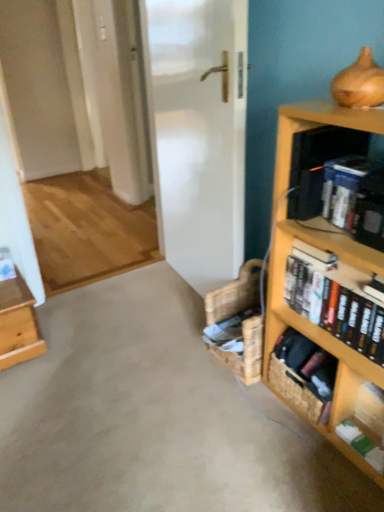
Measure the distance between point (336, 323) and camera.

Point (336, 323) and camera are 1.37 meters apart.

Measure the distance between light brown wooden table at left and camera.

The depth of light brown wooden table at left is 1.83 meters.

What do you see at coordinates (318, 163) in the screenshot?
I see `black plastic shelf at upper right` at bounding box center [318, 163].

The height and width of the screenshot is (512, 384). What do you see at coordinates (303, 374) in the screenshot?
I see `woven brown basket at lower right` at bounding box center [303, 374].

Measure the distance between wooden bookcase at right and camera.

wooden bookcase at right is 1.04 meters away from camera.

You are a GUI agent. You are given a task and a screenshot of the screen. Output one action in this format:
    pyautogui.click(x=<x>, y=<y>)
    Task: Click on the hardcover books at right, the second book when ordered from top to bottom
    The width and height of the screenshot is (384, 512).
    Given the screenshot: What is the action you would take?
    pyautogui.click(x=335, y=298)

Between point (71, 393) and point (348, 217), which one is positioned behind?

The point (71, 393) is behind.

Considering the relative sizes of smooth concrete floor at center and blue hardcover book at upper right, which ranks as the first book in top-to-bottom order, in the image provided, is smooth concrete floor at center thinner than blue hardcover book at upper right, which ranks as the first book in top-to-bottom order,?

In fact, smooth concrete floor at center might be wider than blue hardcover book at upper right, which ranks as the first book in top-to-bottom order.

Considering the positions of objects smooth concrete floor at center and blue hardcover book at upper right, which ranks as the first book in top-to-bottom order, in the image provided, who is behind, smooth concrete floor at center or blue hardcover book at upper right, which ranks as the first book in top-to-bottom order,?

blue hardcover book at upper right, which ranks as the first book in top-to-bottom order, is behind.

In the scene shown: Which is more to the right, smooth concrete floor at center or blue hardcover book at upper right, which ranks as the 3th book in bottom-to-top order?

blue hardcover book at upper right, which ranks as the 3th book in bottom-to-top order.

Looking at this image, could you tell me if light brown wooden table at left is turned towards green matte book at lower right, placed as the third book when sorted from top to bottom?

No.

Does light brown wooden table at left appear on the left side of green matte book at lower right, placed as the third book when sorted from top to bottom?

Yes, light brown wooden table at left is to the left of green matte book at lower right, placed as the third book when sorted from top to bottom.

Consider the image. Is light brown wooden table at left in front of or behind green matte book at lower right, placed as the third book when sorted from top to bottom, in the image?

In the image, light brown wooden table at left appears behind green matte book at lower right, placed as the third book when sorted from top to bottom.

Is blue hardcover book at upper right, which ranks as the 3th book in bottom-to-top order, completely or partially outside of light brown wooden table at left?

blue hardcover book at upper right, which ranks as the 3th book in bottom-to-top order, lies outside light brown wooden table at left's area.

Is blue hardcover book at upper right, which ranks as the 3th book in bottom-to-top order, shorter than light brown wooden table at left?

Indeed, blue hardcover book at upper right, which ranks as the 3th book in bottom-to-top order, has a lesser height compared to light brown wooden table at left.

Is blue hardcover book at upper right, which ranks as the first book in top-to-bottom order, facing away from light brown wooden table at left?

No.

Considering the positions of objects blue hardcover book at upper right, which ranks as the first book in top-to-bottom order, and light brown wooden table at left in the image provided, who is more to the right, blue hardcover book at upper right, which ranks as the first book in top-to-bottom order, or light brown wooden table at left?

From the viewer's perspective, blue hardcover book at upper right, which ranks as the first book in top-to-bottom order, appears more on the right side.

Considering the relative sizes of black plastic shelf at upper right and wooden bookcase at right in the image provided, is black plastic shelf at upper right wider than wooden bookcase at right?

No, black plastic shelf at upper right is not wider than wooden bookcase at right.

Who is more distant, black plastic shelf at upper right or wooden bookcase at right?

Positioned behind is black plastic shelf at upper right.

The image size is (384, 512). In order to click on shelf located above the wooden bookcase at right (from a real-world perspective) in this screenshot , I will do `click(318, 163)`.

Considering the relative positions of black plastic shelf at upper right and wooden bookcase at right in the image provided, is black plastic shelf at upper right to the right of wooden bookcase at right from the viewer's perspective?

No, black plastic shelf at upper right is not to the right of wooden bookcase at right.

Which is correct: woven brown basket at lower right is inside black plastic shelf at upper right, or outside of it?

woven brown basket at lower right is not enclosed by black plastic shelf at upper right.

Is woven brown basket at lower right next to black plastic shelf at upper right and touching it?

There is a gap between woven brown basket at lower right and black plastic shelf at upper right.

Is woven brown basket at lower right facing away from black plastic shelf at upper right?

No, woven brown basket at lower right is not facing away from black plastic shelf at upper right.

Is point (362, 215) closer or farther from the camera than point (73, 339)?

Point (362, 215) appears to be closer to the viewer than point (73, 339).

Could you measure the distance between blue hardcover book at upper right, which ranks as the 3th book in bottom-to-top order, and smooth concrete floor at center?

38.32 inches.

Relative to smooth concrete floor at center, is blue hardcover book at upper right, which ranks as the first book in top-to-bottom order, in front or behind?

blue hardcover book at upper right, which ranks as the first book in top-to-bottom order, is positioned farther from the viewer than smooth concrete floor at center.

From the image's perspective, which is above, blue hardcover book at upper right, which ranks as the 3th book in bottom-to-top order, or smooth concrete floor at center?

blue hardcover book at upper right, which ranks as the 3th book in bottom-to-top order.

From a real-world perspective, who is located higher, wooden bookcase at right or woven brown basket at lower right?

From a 3D spatial view, wooden bookcase at right is above.

Between wooden bookcase at right and woven brown basket at lower right, which one has larger width?

With larger width is wooden bookcase at right.

Can you confirm if wooden bookcase at right is positioned to the right of woven brown basket at lower right?

Indeed, wooden bookcase at right is positioned on the right side of woven brown basket at lower right.

Is wooden bookcase at right positioned far away from woven brown basket at lower right?

They are positioned close to each other.

I want to click on concrete on the left of the blue hardcover book at upper right, which ranks as the first book in top-to-bottom order, so click(155, 416).

Locate an element on the screen. This screenshot has width=384, height=512. table behind the green matte book at lower right, placed as the third book when sorted from top to bottom is located at coordinates (18, 323).

Which object lies nearer to the anchor point light brown wooden table at left, hardcover books at right, the second book when ordered from top to bottom, or blue hardcover book at upper right, which ranks as the 3th book in bottom-to-top order?

hardcover books at right, the second book when ordered from top to bottom.

Estimate the real-world distances between objects in this image. Which object is further from woven brown basket at lower right, black plastic shelf at upper right or light brown wooden table at left?

Based on the image, light brown wooden table at left appears to be further to woven brown basket at lower right.

Considering their positions, is woven brown basket at lower right positioned closer to light brown wooden table at left than blue hardcover book at upper right, which ranks as the first book in top-to-bottom order?

woven brown basket at lower right is positioned closer to the anchor light brown wooden table at left.

Based on the photo, from the image, which object appears to be nearer to black plastic shelf at upper right, green matte book at lower right, which is the 1th book in bottom-to-top order, or light brown wooden table at left?

green matte book at lower right, which is the 1th book in bottom-to-top order.

Estimate the real-world distances between objects in this image. Which object is further from smooth concrete floor at center, green matte book at lower right, placed as the third book when sorted from top to bottom, or wooden bookcase at right?

green matte book at lower right, placed as the third book when sorted from top to bottom, lies further to smooth concrete floor at center than the other object.

When comparing their distances from green matte book at lower right, which is the 1th book in bottom-to-top order, does blue hardcover book at upper right, which ranks as the 3th book in bottom-to-top order, or woven brown basket at lower right seem further?

blue hardcover book at upper right, which ranks as the 3th book in bottom-to-top order, lies further to green matte book at lower right, which is the 1th book in bottom-to-top order, than the other object.

When comparing their distances from woven brown basket at lower right, does light brown wooden table at left or smooth concrete floor at center seem closer?

smooth concrete floor at center is positioned closer to the anchor woven brown basket at lower right.

Considering their positions, is hardcover books at right, the 2th book from the bottom, positioned closer to black plastic shelf at upper right than light brown wooden table at left?

hardcover books at right, the 2th book from the bottom, is closer to black plastic shelf at upper right.

Where is `bookcase between black plastic shelf at upper right and green matte book at lower right, which is the 1th book in bottom-to-top order, in the up-down direction`? Image resolution: width=384 pixels, height=512 pixels. bookcase between black plastic shelf at upper right and green matte book at lower right, which is the 1th book in bottom-to-top order, in the up-down direction is located at coordinates (323, 248).

Find the location of a particular element. The image size is (384, 512). book situated between smooth concrete floor at center and hardcover books at right, the second book when ordered from top to bottom, from left to right is located at coordinates (355, 198).

Locate an element on the screen. The image size is (384, 512). basket located between light brown wooden table at left and green matte book at lower right, which is the 1th book in bottom-to-top order, in the left-right direction is located at coordinates (303, 374).

I want to click on concrete located between light brown wooden table at left and wooden bookcase at right in the left-right direction, so click(155, 416).